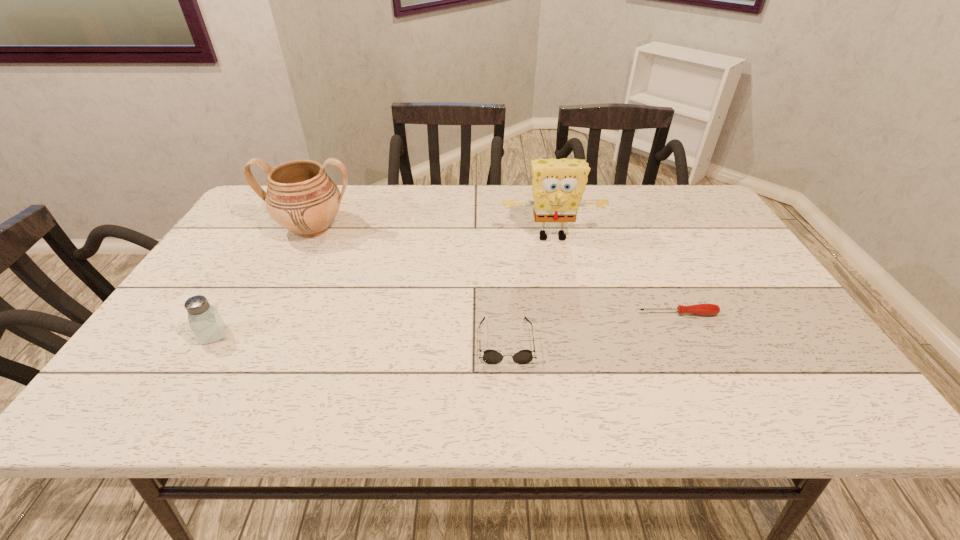
At what (x,y) coordinates should I click in order to perform the action: click on vacant space that's between the urn and the rightmost object. Please return your answer as a coordinate pair (x, y). The image size is (960, 540). Looking at the image, I should click on (494, 271).

Where is `free point between the sponge and the saltshaker`? free point between the sponge and the saltshaker is located at coordinates (383, 286).

In order to click on free area in between the sponge and the third shortest object in this screenshot , I will do `click(383, 286)`.

Where is `free space that is in between the urn and the sunglasses`? The width and height of the screenshot is (960, 540). free space that is in between the urn and the sunglasses is located at coordinates (409, 285).

Where is `free space that is in between the third farthest object and the sponge`? The image size is (960, 540). free space that is in between the third farthest object and the sponge is located at coordinates (614, 275).

I want to click on free space between the second shortest object and the urn, so click(x=409, y=285).

Locate an element on the screen. Image resolution: width=960 pixels, height=540 pixels. free space that is in between the third nearest object and the saltshaker is located at coordinates (445, 324).

Where is `vacant space that is in between the sunglasses and the saltshaker`? vacant space that is in between the sunglasses and the saltshaker is located at coordinates (360, 338).

Where is `blank region between the sunglasses and the rightmost object`? blank region between the sunglasses and the rightmost object is located at coordinates (591, 327).

The width and height of the screenshot is (960, 540). In order to click on free space between the third nearest object and the saltshaker in this screenshot , I will do `click(445, 324)`.